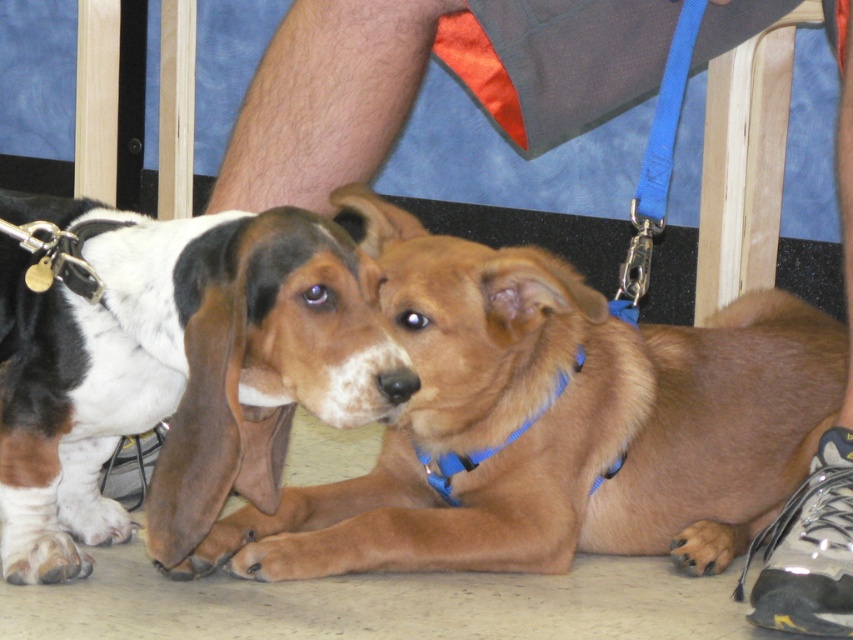
Does brown furry dog at center have a greater height compared to blue fabric neckband at center?

Yes.

Between brown furry dog at center and blue fabric neckband at center, which one appears on the right side from the viewer's perspective?

From the viewer's perspective, brown furry dog at center appears more on the right side.

Is point (213, 524) less distant than point (479, 461)?

Yes, point (213, 524) is closer to viewer.

Where is `brown furry dog at center`? This screenshot has width=853, height=640. brown furry dog at center is located at coordinates (555, 422).

Is brown furry dog at center above brown fur dog at center?

Incorrect, brown furry dog at center is not positioned above brown fur dog at center.

Locate an element on the screen. The image size is (853, 640). brown furry dog at center is located at coordinates (555, 422).

I want to click on brown furry dog at center, so click(x=555, y=422).

Image resolution: width=853 pixels, height=640 pixels. Identify the location of brown furry dog at center. (555, 422).

How distant is brown fur dog at center from blue fabric neckband at center?

They are 17.81 inches apart.

Who is positioned more to the right, brown fur dog at center or blue fabric neckband at center?

blue fabric neckband at center

What are the coordinates of `brown fur dog at center` in the screenshot? It's located at (175, 369).